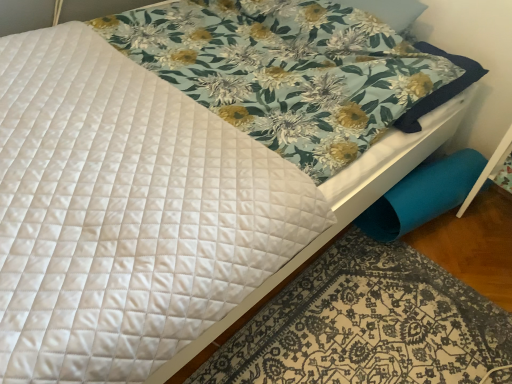
Question: Would you say blue fabric swivel chair at lower right is to the left or to the right of blue fabric at lower right in the picture?

Choices:
 (A) right
 (B) left

Answer: (A)

Question: In terms of width, does blue fabric swivel chair at lower right look wider or thinner when compared to blue fabric at lower right?

Choices:
 (A) wide
 (B) thin

Answer: (B)

Question: Considering the positions of point (388, 203) and point (202, 380), is point (388, 203) closer or farther from the camera than point (202, 380)?

Choices:
 (A) farther
 (B) closer

Answer: (A)

Question: From a real-world perspective, is blue fabric at lower right above or below blue fabric swivel chair at lower right?

Choices:
 (A) above
 (B) below

Answer: (B)

Question: In terms of height, does blue fabric at lower right look taller or shorter compared to blue fabric swivel chair at lower right?

Choices:
 (A) tall
 (B) short

Answer: (B)

Question: Is blue fabric at lower right inside or outside of blue fabric swivel chair at lower right?

Choices:
 (A) inside
 (B) outside

Answer: (B)

Question: From the image's perspective, relative to blue fabric swivel chair at lower right, is blue fabric at lower right above or below?

Choices:
 (A) above
 (B) below

Answer: (B)